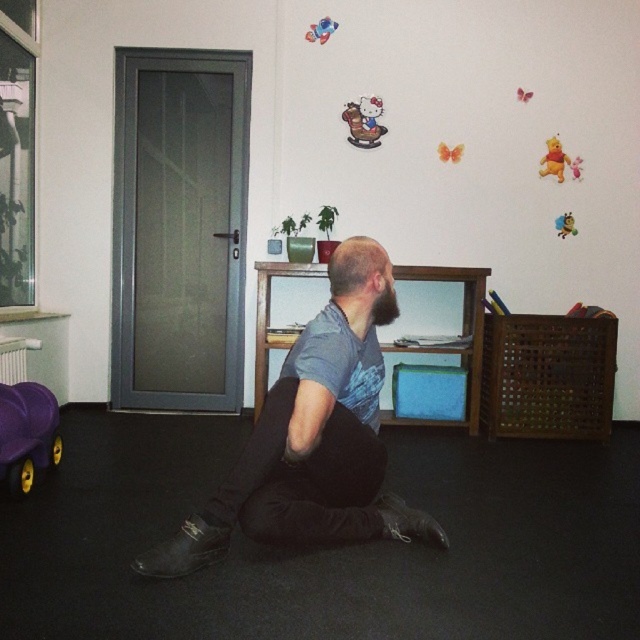
Question: Estimate the real-world distances between objects in this image. Which object is farther from the plush yellow bear at upper right?

Choices:
 (A) velvet winnie the pooh at upper right
 (B) smooth plastic toy at upper center
 (C) purple rubber toy car at lower left
 (D) dark gray fabric pants at center

Answer: (C)

Question: Does dark gray fabric pants at center appear on the left side of matte plastic rocking horse at upper center?

Choices:
 (A) yes
 (B) no

Answer: (A)

Question: Which object is farther from the camera taking this photo?

Choices:
 (A) plush yellow bear at upper right
 (B) matte plastic rocking horse at upper center

Answer: (B)

Question: Can you confirm if velvet winnie the pooh at upper right is positioned to the left of plush yellow bear at upper right?

Choices:
 (A) no
 (B) yes

Answer: (B)

Question: Is purple rubber toy car at lower left in front of plush yellow bear at upper right?

Choices:
 (A) yes
 (B) no

Answer: (A)

Question: Which is nearer to the purple rubber toy car at lower left?

Choices:
 (A) matte plastic rocking horse at upper center
 (B) dark gray fabric pants at center

Answer: (B)